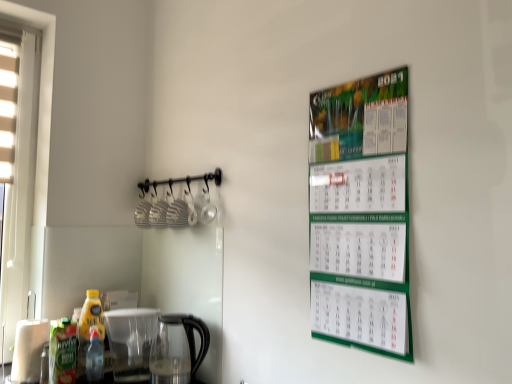
Question: From the image's perspective, is translucent plastic bottle at lower left, arranged as the 1th bottle when viewed from the right, located above transparent glass coffeepot at lower center?

Choices:
 (A) yes
 (B) no

Answer: (B)

Question: Does translucent plastic bottle at lower left, the third bottle from the left, touch transparent glass coffeepot at lower center?

Choices:
 (A) no
 (B) yes

Answer: (A)

Question: Can you confirm if translucent plastic bottle at lower left, arranged as the 1th bottle when viewed from the right, is bigger than transparent glass coffeepot at lower center?

Choices:
 (A) yes
 (B) no

Answer: (B)

Question: Does translucent plastic bottle at lower left, arranged as the 1th bottle when viewed from the right, lie behind transparent glass coffeepot at lower center?

Choices:
 (A) no
 (B) yes

Answer: (B)

Question: Is translucent plastic bottle at lower left, arranged as the 1th bottle when viewed from the right, facing away from transparent glass coffeepot at lower center?

Choices:
 (A) yes
 (B) no

Answer: (B)

Question: Is translucent plastic bottle at lower left, arranged as the 1th bottle when viewed from the right, to the right of transparent glass coffeepot at lower center from the viewer's perspective?

Choices:
 (A) no
 (B) yes

Answer: (A)

Question: Does yellow plastic bottle at lower left, arranged as the 2th bottle when viewed from the left, have a smaller size compared to green matte juice at lower left, the first bottle in the left-to-right sequence?

Choices:
 (A) no
 (B) yes

Answer: (A)

Question: Is yellow plastic bottle at lower left, acting as the second bottle starting from the right, with green matte juice at lower left, the 3th bottle positioned from the right?

Choices:
 (A) yes
 (B) no

Answer: (A)

Question: Is yellow plastic bottle at lower left, acting as the second bottle starting from the right, completely or partially outside of green matte juice at lower left, the 3th bottle positioned from the right?

Choices:
 (A) yes
 (B) no

Answer: (A)

Question: Is yellow plastic bottle at lower left, arranged as the 2th bottle when viewed from the left, shorter than green matte juice at lower left, the first bottle in the left-to-right sequence?

Choices:
 (A) no
 (B) yes

Answer: (A)

Question: Is yellow plastic bottle at lower left, acting as the second bottle starting from the right, positioned in front of green matte juice at lower left, the 3th bottle positioned from the right?

Choices:
 (A) yes
 (B) no

Answer: (B)

Question: Is yellow plastic bottle at lower left, arranged as the 2th bottle when viewed from the left, positioned far away from green matte juice at lower left, the first bottle in the left-to-right sequence?

Choices:
 (A) yes
 (B) no

Answer: (B)

Question: Is green matte calendar at upper right outside green matte juice at lower left, the first bottle in the left-to-right sequence?

Choices:
 (A) no
 (B) yes

Answer: (B)